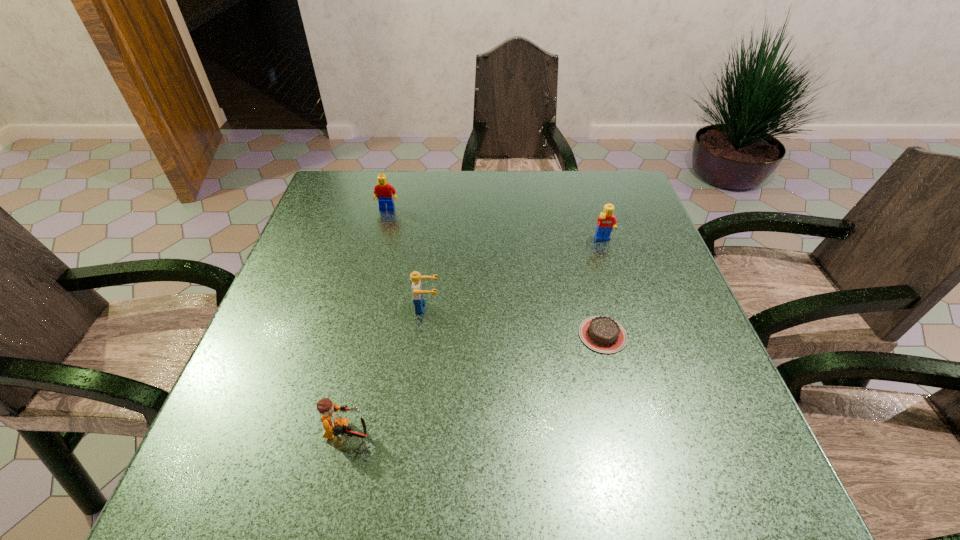
Where is `free location located 0.310m on the face of the third farthest Lego`? This screenshot has width=960, height=540. free location located 0.310m on the face of the third farthest Lego is located at coordinates (580, 307).

At what (x,y) coordinates should I click in order to perform the action: click on vacant space positioned holding a crossbow in the hands of the nearest Lego. Please return your answer as a coordinate pair (x, y). Looking at the image, I should click on (591, 435).

The height and width of the screenshot is (540, 960). Identify the location of vacant position located on the left of the chocolate cake. (387, 335).

At what (x,y) coordinates should I click in order to perform the action: click on object that is at the far edge. Please return your answer as a coordinate pair (x, y). Image resolution: width=960 pixels, height=540 pixels. Looking at the image, I should click on (383, 191).

Locate an element on the screen. object that is positioned at the near edge is located at coordinates (334, 425).

You are a GUI agent. You are given a task and a screenshot of the screen. Output one action in this format:
    pyautogui.click(x=<x>, y=<y>)
    Task: Click on the Lego that is at the right edge
    Image resolution: width=960 pixels, height=540 pixels.
    Given the screenshot: What is the action you would take?
    pyautogui.click(x=607, y=221)

This screenshot has height=540, width=960. Find the location of `chocolate cake situated at the right edge`. chocolate cake situated at the right edge is located at coordinates (602, 334).

Locate an element on the screen. vacant space at the far edge of the desktop is located at coordinates (534, 200).

The height and width of the screenshot is (540, 960). What are the coordinates of `vacant area at the left edge` in the screenshot? It's located at (337, 271).

This screenshot has height=540, width=960. In the image, there is a desktop. Find the location of `vacant space at the right edge`. vacant space at the right edge is located at coordinates (647, 298).